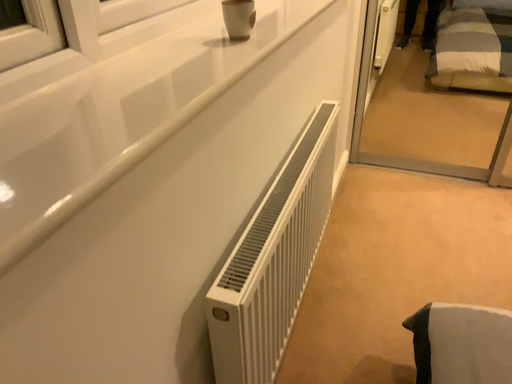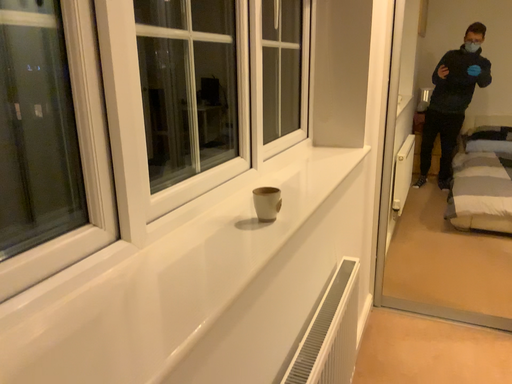
Question: How did the camera likely rotate when shooting the video?

Choices:
 (A) rotated upward
 (B) rotated downward

Answer: (A)